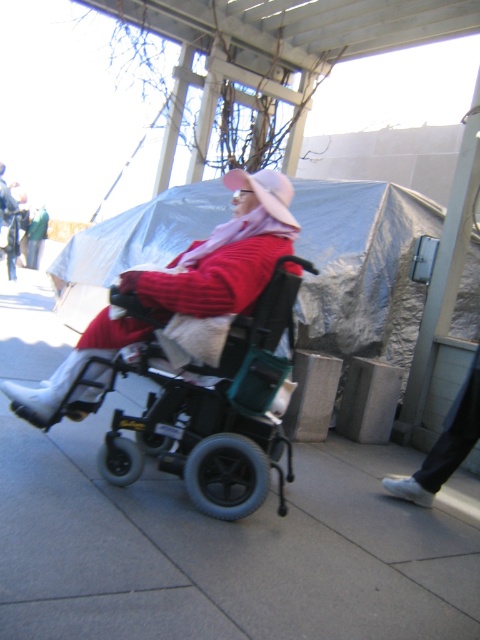
Who is taller, gray concrete pavement at center or black plastic wheelchair at center?

Standing taller between the two is black plastic wheelchair at center.

Can you confirm if gray concrete pavement at center is positioned to the left of black plastic wheelchair at center?

In fact, gray concrete pavement at center is to the right of black plastic wheelchair at center.

Measure the distance between gray concrete pavement at center and camera.

gray concrete pavement at center and camera are 1.14 meters apart.

The height and width of the screenshot is (640, 480). Find the location of `gray concrete pavement at center`. gray concrete pavement at center is located at coordinates (226, 547).

Who is shorter, gray concrete pavement at center or matte pink sweater at center?

gray concrete pavement at center

What do you see at coordinates (226, 547) in the screenshot?
I see `gray concrete pavement at center` at bounding box center [226, 547].

Locate an element on the screen. Image resolution: width=480 pixels, height=640 pixels. gray concrete pavement at center is located at coordinates (226, 547).

Between black plastic wheelchair at center and matte pink sweater at center, which one is positioned lower?

black plastic wheelchair at center is below.

Where is `black plastic wheelchair at center`? black plastic wheelchair at center is located at coordinates (211, 406).